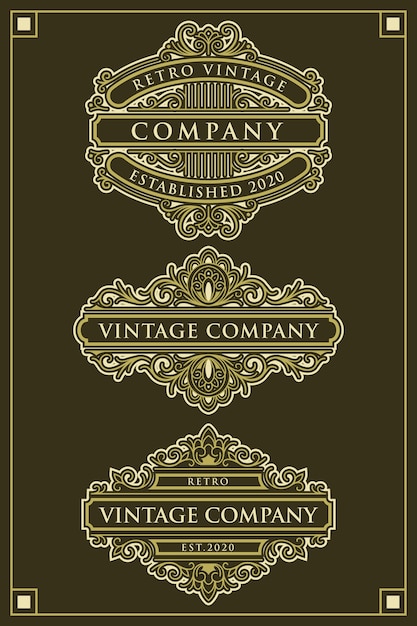
Identify the location of corner. (18, 603), (395, 598), (394, 28), (26, 23).